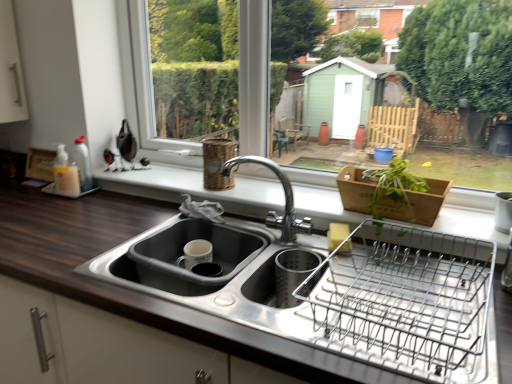
This screenshot has width=512, height=384. Identify the location of vacant point to the right of woven brown basket at upper center. (262, 182).